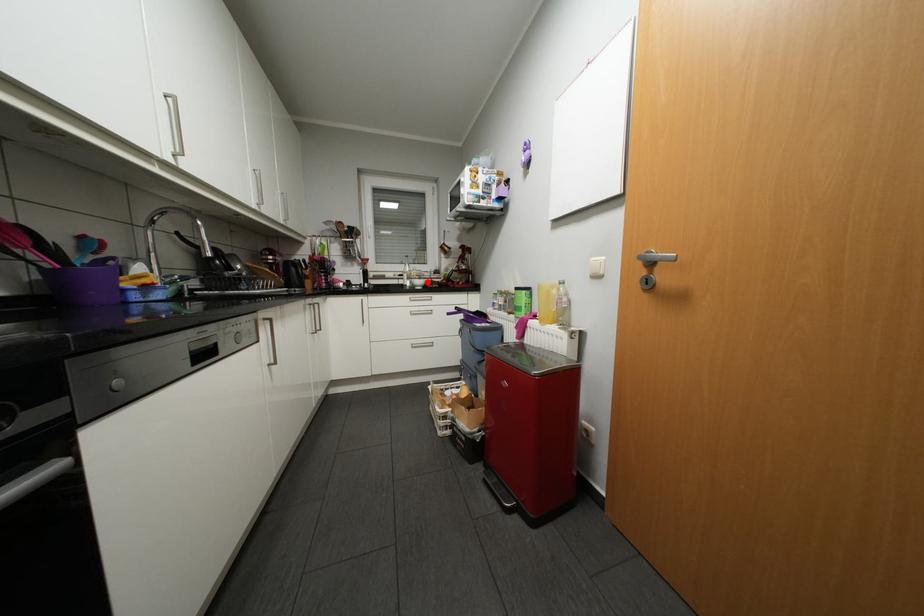
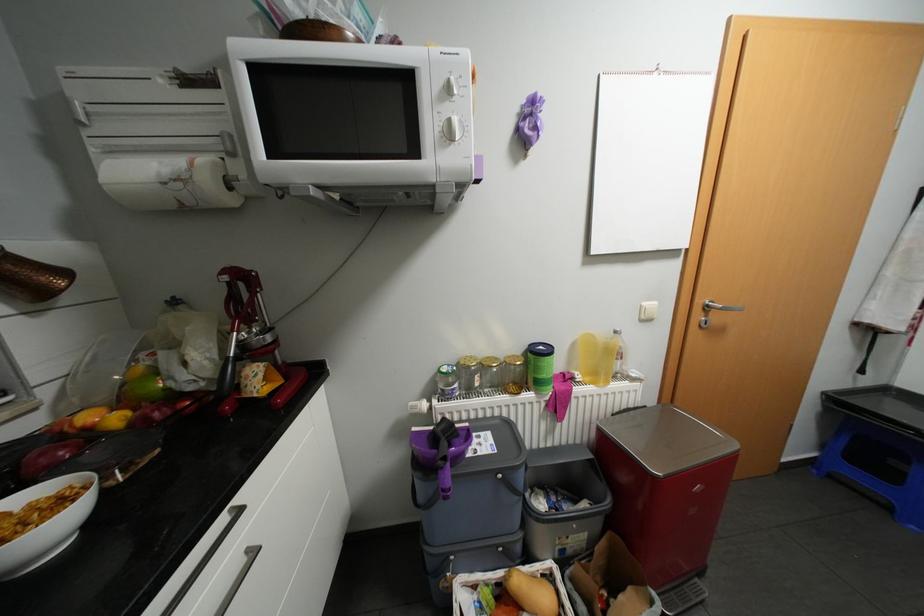
The point at the highlighted location is marked in the first image. Where is the corresponding point in the second image?

(44, 522)